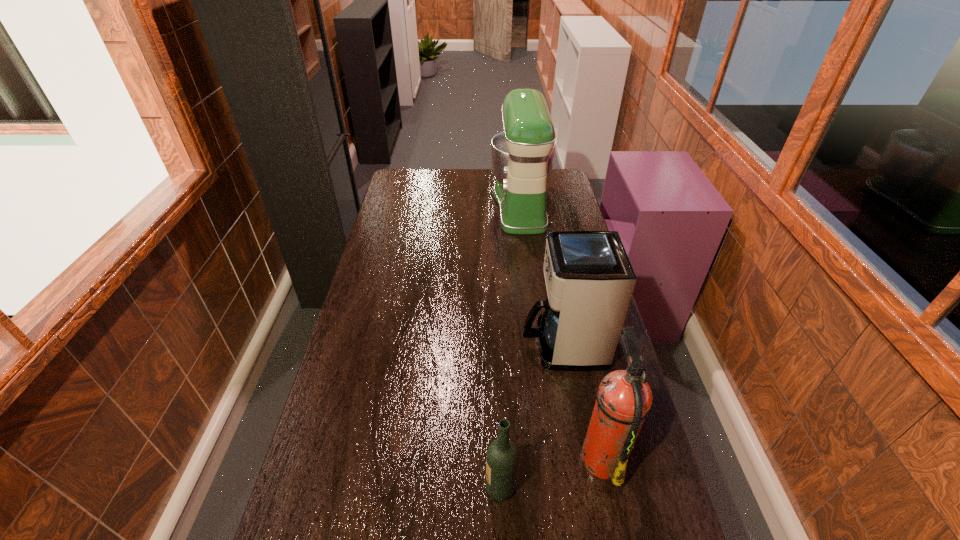
Where is `the farthest object`? Image resolution: width=960 pixels, height=540 pixels. the farthest object is located at coordinates (522, 156).

Where is `fire extinguisher`? Image resolution: width=960 pixels, height=540 pixels. fire extinguisher is located at coordinates (624, 398).

You are a GUI agent. You are given a task and a screenshot of the screen. Output one action in this format:
    pyautogui.click(x=<x>, y=<y>)
    Task: Click on the coffee maker
    This screenshot has width=960, height=540.
    Given the screenshot: What is the action you would take?
    pyautogui.click(x=589, y=279)

Where is `the shortest object`? The height and width of the screenshot is (540, 960). the shortest object is located at coordinates (502, 456).

Identify the location of free spot located 0.360m on the controls of the mixer. (414, 205).

Where is `vacant area located 0.400m on the controls of the mixer`? vacant area located 0.400m on the controls of the mixer is located at coordinates (405, 205).

Find the location of `vacant area situated on the controls of the mixer`. vacant area situated on the controls of the mixer is located at coordinates (452, 205).

Find the location of a particular element. The image size is (960, 540). free space located 0.300m at the nozzle of the fire extinguisher is located at coordinates (464, 456).

The height and width of the screenshot is (540, 960). I want to click on free spot located 0.300m at the nozzle of the fire extinguisher, so click(x=464, y=456).

Locate an element on the screen. The width and height of the screenshot is (960, 540). vacant area situated 0.220m at the nozzle of the fire extinguisher is located at coordinates (495, 456).